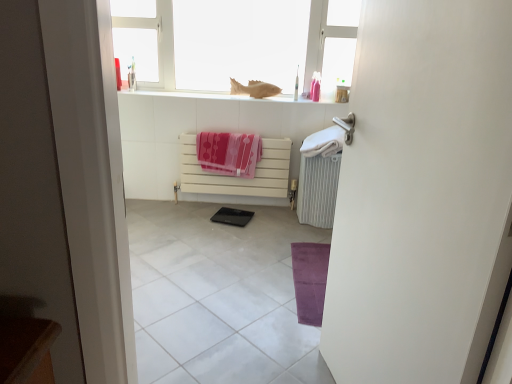
I want to click on white plastic toothbrush at upper center, so click(x=296, y=85).

In order to face white glossy tile at center, should I rotate leftwards or rightwards?

To align with it, rotate left about 5.662°.

You are a GUI agent. You are given a task and a screenshot of the screen. Output one action in this format:
    pyautogui.click(x=<x>, y=<y>)
    Task: Click on the white matte radiator at center
    This screenshot has height=384, width=512.
    Given the screenshot: What is the action you would take?
    pyautogui.click(x=238, y=177)

The image size is (512, 384). Describe the element at coordinates (318, 190) in the screenshot. I see `white metallic radiator at right` at that location.

At what (x,y) coordinates should I click in order to perform the action: click on pink fabric beach towel at center, which is counted as the first beach towel, starting from the left. Please return your answer as a coordinate pair (x, y). The width and height of the screenshot is (512, 384). Looking at the image, I should click on (229, 153).

Looking at the image, does pink fabric beach towel at center, which is counted as the first beach towel, starting from the left, seem bigger or smaller compared to black glossy pad at center?

Considering their sizes, pink fabric beach towel at center, which is counted as the first beach towel, starting from the left, takes up more space than black glossy pad at center.

Is pink fabric beach towel at center, the 2th beach towel positioned from the right, next to black glossy pad at center?

There is a gap between pink fabric beach towel at center, the 2th beach towel positioned from the right, and black glossy pad at center.

Between point (256, 152) and point (226, 211), which one is positioned behind?

The point (256, 152) is farther.

Looking at this image, can you confirm if white glossy tile at center is wider than white matte window sill at upper center?

Yes.

What are the coordinates of `tile on the left of white matte window sill at upper center` in the screenshot? It's located at (219, 296).

From the image's perspective, which is below, white glossy tile at center or white matte window sill at upper center?

From the image's view, white glossy tile at center is below.

In the scene shown: Considering the positions of objects white glossy tile at center and white matte window sill at upper center in the image provided, who is more to the left, white glossy tile at center or white matte window sill at upper center?

white glossy tile at center is more to the left.

Where is `toiletry in front of the white matte window sill at upper center`? This screenshot has width=512, height=384. toiletry in front of the white matte window sill at upper center is located at coordinates (296, 85).

Who is shorter, white matte window sill at upper center or white plastic toothbrush at upper center?

Standing shorter between the two is white matte window sill at upper center.

From the image's perspective, between white matte window sill at upper center and white plastic toothbrush at upper center, which one is located above?

white plastic toothbrush at upper center is shown above in the image.

Can you confirm if white matte window sill at upper center is smaller than white plastic toothbrush at upper center?

No, white matte window sill at upper center is not smaller than white plastic toothbrush at upper center.

Are white matte window sill at upper center and white matte door at right far apart?

Absolutely, white matte window sill at upper center is distant from white matte door at right.

Consider the image. Which is nearer, (187,97) or (448,373)?

Point (448,373)

Can you confirm if white matte window sill at upper center is bigger than white matte door at right?

Incorrect, white matte window sill at upper center is not larger than white matte door at right.

From a real-world perspective, which object rests below the other?

From a 3D spatial view, white glossy tile at center is below.

Is white matte window sill at upper center inside the boundaries of white glossy tile at center, or outside?

white matte window sill at upper center is not inside white glossy tile at center, it's outside.

From the image's perspective, is white matte window sill at upper center above or below white glossy tile at center?

white matte window sill at upper center is above white glossy tile at center.

Looking at this image, between white matte window sill at upper center and white glossy tile at center, which one has smaller width?

white matte window sill at upper center is thinner.

Based on the photo, is white soft towel at right, arranged as the second beach towel when viewed from the left, not inside pink fabric beach towel at center, which is counted as the first beach towel, starting from the left?

white soft towel at right, arranged as the second beach towel when viewed from the left, lies outside pink fabric beach towel at center, which is counted as the first beach towel, starting from the left,'s area.

Is white soft towel at right, arranged as the second beach towel when viewed from the left, taller or shorter than pink fabric beach towel at center, which is counted as the first beach towel, starting from the left?

Considering their sizes, white soft towel at right, arranged as the second beach towel when viewed from the left, has less height than pink fabric beach towel at center, which is counted as the first beach towel, starting from the left.

Which object is positioned more to the right, white soft towel at right, arranged as the second beach towel when viewed from the left, or pink fabric beach towel at center, which is counted as the first beach towel, starting from the left?

From the viewer's perspective, white soft towel at right, arranged as the second beach towel when viewed from the left, appears more on the right side.

Image resolution: width=512 pixels, height=384 pixels. Identify the location of beach towel on the left of white soft towel at right, arranged as the second beach towel when viewed from the left. (229, 153).

Is pink fabric beach towel at center, which is counted as the first beach towel, starting from the left, beside white glossy window at upper center?

No, pink fabric beach towel at center, which is counted as the first beach towel, starting from the left, is not in contact with white glossy window at upper center.

In the scene shown: From the image's perspective, would you say pink fabric beach towel at center, the 2th beach towel positioned from the right, is shown under white glossy window at upper center?

Yes, from the image's perspective, pink fabric beach towel at center, the 2th beach towel positioned from the right, is beneath white glossy window at upper center.

Is pink fabric beach towel at center, the 2th beach towel positioned from the right, at the left side of white glossy window at upper center?

Yes.

Does point (210, 148) come farther from viewer compared to point (236, 28)?

No, (210, 148) is in front of (236, 28).

I want to click on pad below the pink fabric beach towel at center, the 2th beach towel positioned from the right (from a real-world perspective), so [x=232, y=216].

What are the coordinates of `tile on the left side of white matte window sill at upper center` in the screenshot? It's located at coord(219,296).

Looking at the image, which one is located closer to white glossy window at upper center, purple velvety yoga mat at lower right or white matte radiator at center?

Among the two, white matte radiator at center is located nearer to white glossy window at upper center.

Looking at this image, considering their positions, is white metallic radiator at right positioned closer to pink fabric beach towel at center, which is counted as the first beach towel, starting from the left, than white matte door at right?

white metallic radiator at right lies closer to pink fabric beach towel at center, which is counted as the first beach towel, starting from the left, than the other object.

Looking at the image, which one is located further to white matte window sill at upper center, white glossy tile at center or white matte radiator at center?

white glossy tile at center lies further to white matte window sill at upper center than the other object.

Which object lies further to the anchor point matte beige fish at upper center, white glossy tile at center or white glossy window at upper center?

Among the two, white glossy tile at center is located further to matte beige fish at upper center.

Considering their positions, is white matte radiator at center positioned closer to white plastic toothbrush at upper center than white metallic radiator at right?

Based on the image, white matte radiator at center appears to be nearer to white plastic toothbrush at upper center.

Considering their positions, is pink fabric beach towel at center, the 2th beach towel positioned from the right, positioned further to black glossy pad at center than purple velvety yoga mat at lower right?

Among the two, purple velvety yoga mat at lower right is located further to black glossy pad at center.

Looking at this image, estimate the real-world distances between objects in this image. Which object is closer to white metallic radiator at right, white glossy window at upper center or white matte radiator at center?

white matte radiator at center is positioned closer to the anchor white metallic radiator at right.

Estimate the real-world distances between objects in this image. Which object is closer to white matte radiator at center, white soft towel at right, arranged as the second beach towel when viewed from the left, or white glossy window at upper center?

white soft towel at right, arranged as the second beach towel when viewed from the left.

Identify the location of window sill between purple velvety yoga mat at lower right and white matte radiator at center from front to back. This screenshot has width=512, height=384. (205, 95).

Find the location of a particular element. The height and width of the screenshot is (384, 512). beach towel located between white matte door at right and black glossy pad at center in the depth direction is located at coordinates (324, 142).

This screenshot has width=512, height=384. In order to click on toiletry between white glossy window at upper center and white metallic radiator at right in the vertical direction in this screenshot , I will do `click(296, 85)`.

Identify the location of tile located between white matte door at right and matte beige fish at upper center in the depth direction. (219, 296).